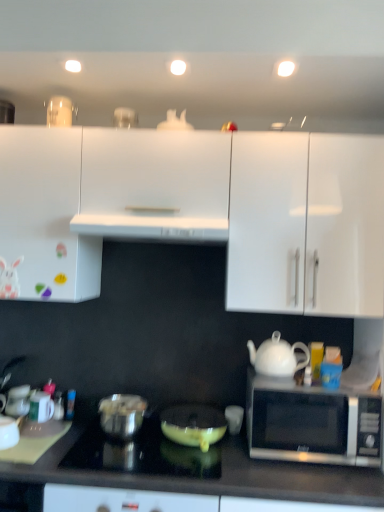
Question: Relative to shiny black cooktop at center, is matte yellow frying pan at center, which is counted as the 3th appliance, starting from the left, in front or behind?

Choices:
 (A) behind
 (B) front

Answer: (A)

Question: From the image's perspective, is matte yellow frying pan at center, the first appliance from the right, located above or below shiny black cooktop at center?

Choices:
 (A) below
 (B) above

Answer: (B)

Question: Which object is positioned farthest from the shiny metallic pot at lower left, placed as the 2th appliance when sorted from right to left?

Choices:
 (A) white glossy cabinet at upper right, which is counted as the third cabinetry, starting from the left
 (B) white matte cabinet at center, the second cabinetry positioned from the left
 (C) white glossy cabinet at left, the third cabinetry positioned from the right
 (D) white plastic exhaust hood at center
 (E) shiny black cooktop at center

Answer: (A)

Question: Which object is positioned farthest from the shiny metallic pot at lower left, placed as the 2th appliance when sorted from right to left?

Choices:
 (A) white glossy cabinet at upper right, which is counted as the third cabinetry, starting from the left
 (B) matte yellow frying pan at center, the first appliance from the right
 (C) white glossy teapot at right
 (D) shiny black cooktop at center
 (E) sleek silver microwave at right

Answer: (A)